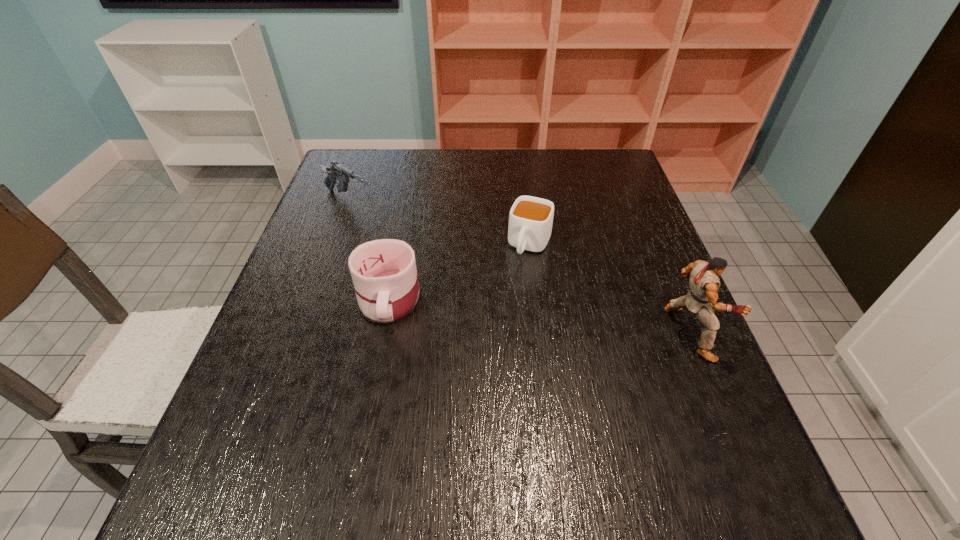
The height and width of the screenshot is (540, 960). I want to click on vacant space on the desktop that is between the third object from right to left and the puncher and is positioned at the barrel of the farthest object, so click(x=534, y=316).

Locate an element on the screen. vacant space on the desktop that is between the mug and the puncher and is positioned on the side with the handle of the third nearest object is located at coordinates (499, 312).